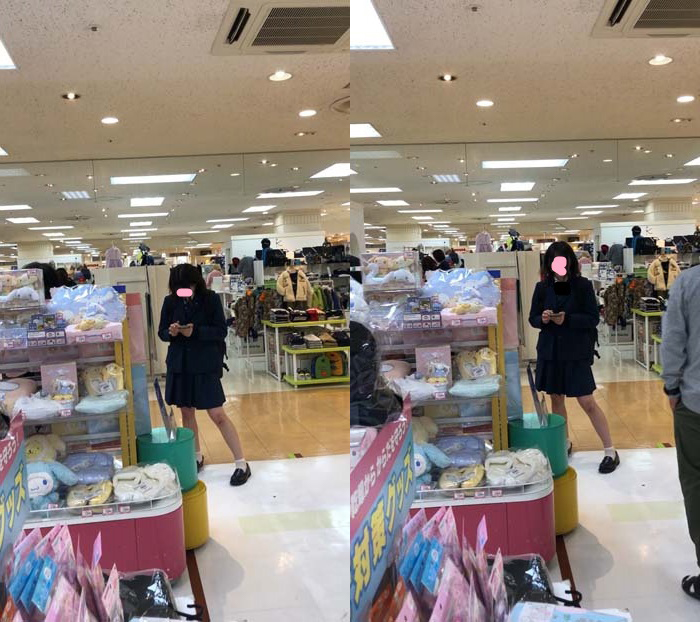
You are a GUI agent. You are given a task and a screenshot of the screen. Output one action in this format:
    pyautogui.click(x=<x>, y=<y>)
    Task: Click on the ceiling
    This screenshot has height=622, width=700.
    Given the screenshot: What is the action you would take?
    pyautogui.click(x=559, y=50), pyautogui.click(x=145, y=53)